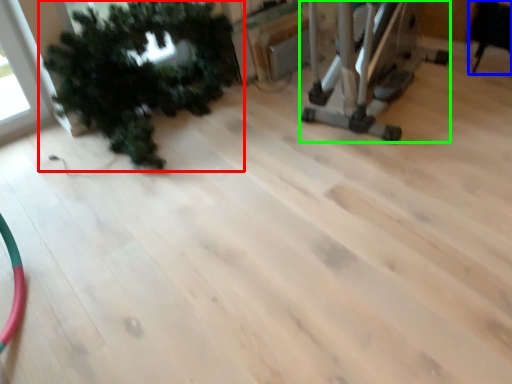
Question: Which object is the closest to the houseplant (highlighted by a red box)? Choose among these: chair (highlighted by a blue box) or equipment (highlighted by a green box).

Choices:
 (A) chair
 (B) equipment

Answer: (B)